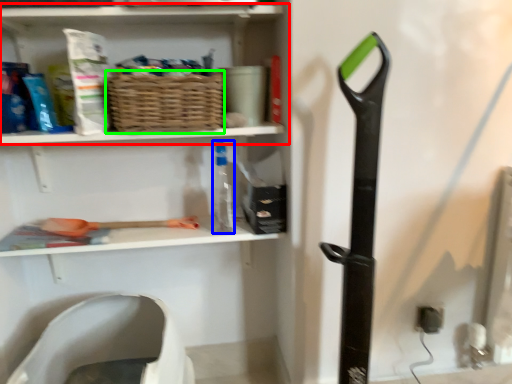
Question: Estimate the real-world distances between objects in this image. Which object is closer to shelf (highlighted by a red box), bottle (highlighted by a blue box) or basket (highlighted by a green box)?

Choices:
 (A) bottle
 (B) basket

Answer: (B)